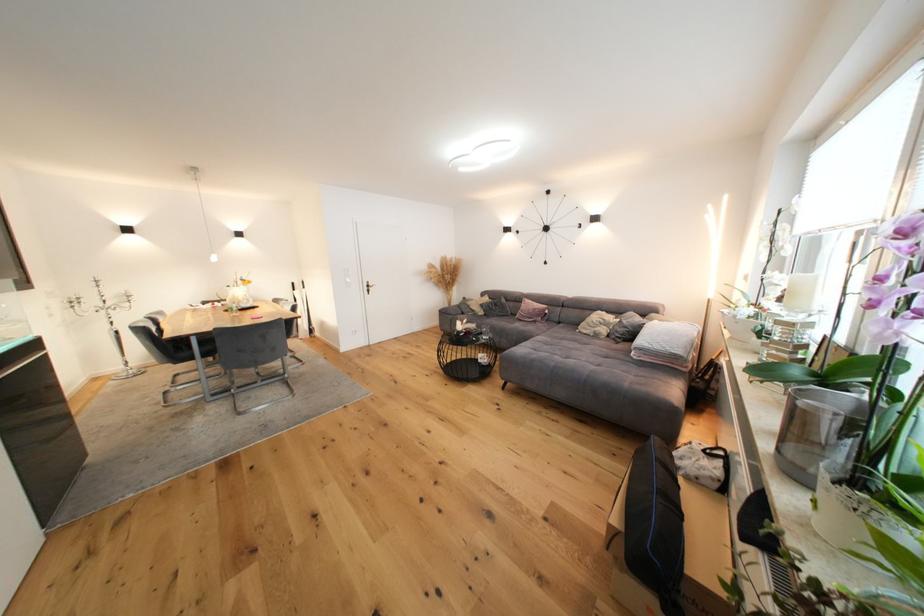
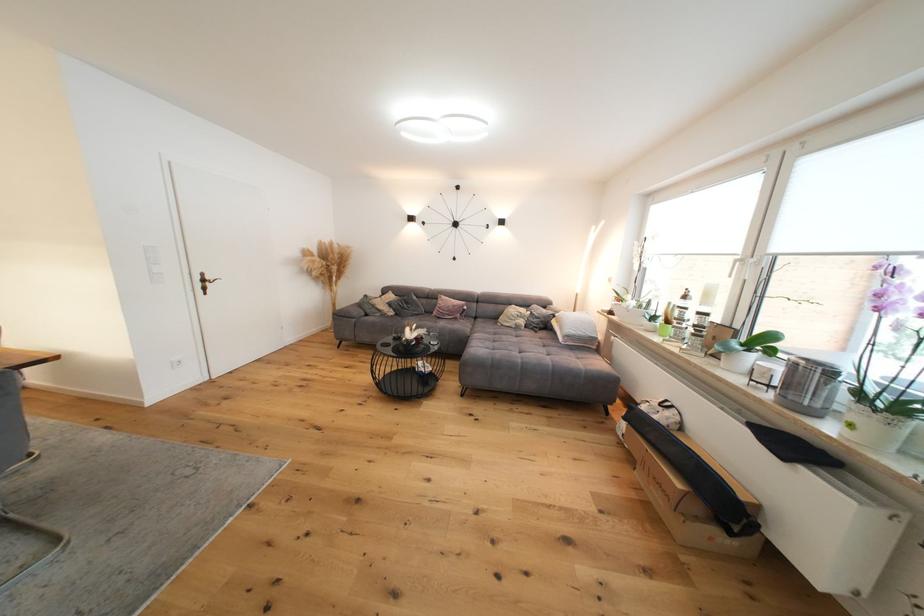
Where in the second image is the point corresponding to point 375,286 from the first image?

(211, 282)